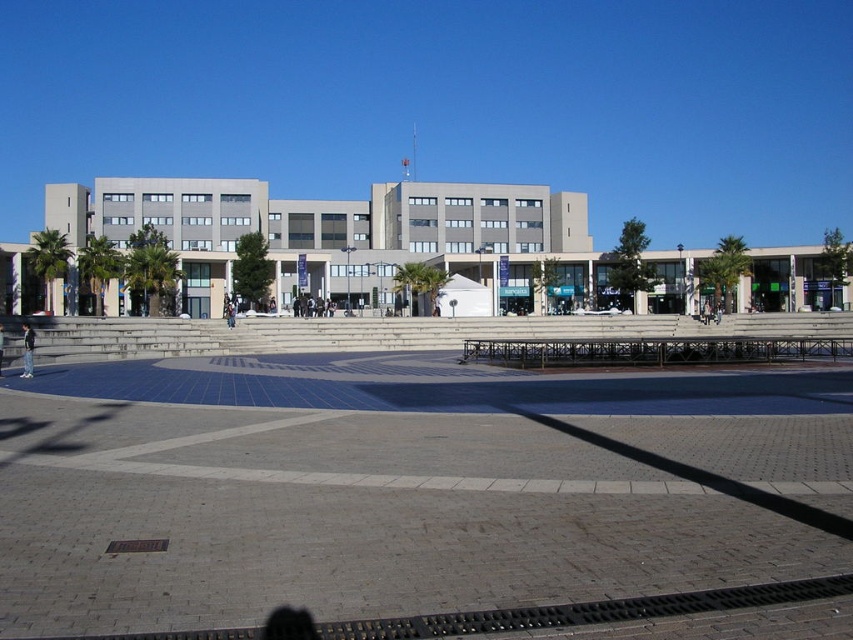
Question: Among these objects, which one is nearest to the camera?

Choices:
 (A) concrete steps at center
 (B) brick pavement at lower center

Answer: (A)

Question: Can you confirm if concrete steps at center is bigger than brick pavement at lower center?

Choices:
 (A) no
 (B) yes

Answer: (B)

Question: Is concrete steps at center wider than brick pavement at lower center?

Choices:
 (A) no
 (B) yes

Answer: (B)

Question: Among these objects, which one is nearest to the camera?

Choices:
 (A) concrete steps at center
 (B) brick pavement at lower center

Answer: (A)

Question: From the image, what is the correct spatial relationship of concrete steps at center in relation to brick pavement at lower center?

Choices:
 (A) right
 (B) left

Answer: (B)